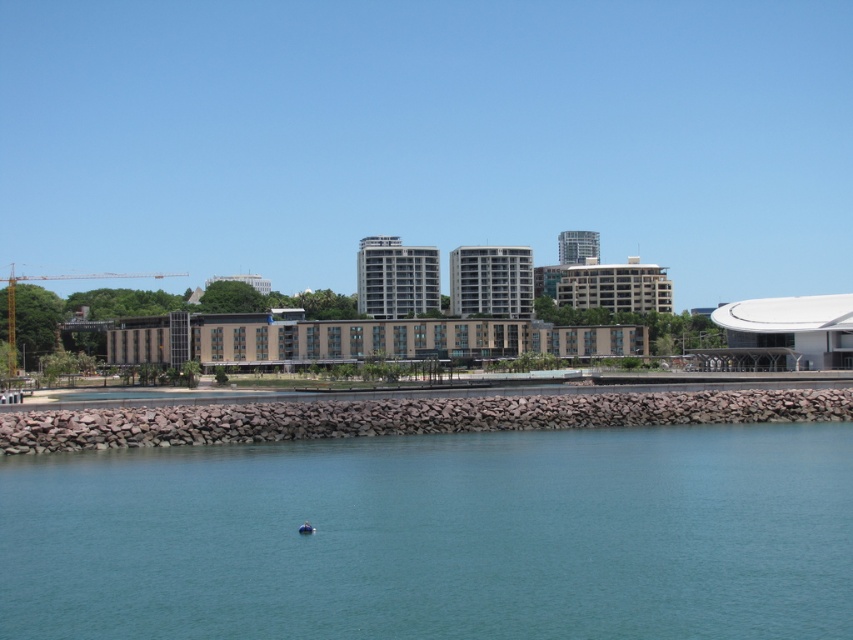
You are a photographer planning to take a photo of the waterfront scene. You want to ensure that both the clear blue water at center and the blue rubber boat at lower center are visible in the frame. Based on their sizes, which object should you prioritize positioning closer to the center of your composition to maintain balance?

The clear blue water at center is larger in size than the blue rubber boat at lower center. To maintain balance in the composition, prioritize positioning the smaller blue rubber boat at lower center closer to the center of the frame, as larger objects naturally draw more attention and can be placed slightly off center.

You are standing on the breakwater and see the clear blue water at center and the blue rubber boat at lower center. Which object is positioned to the right of the other?

The clear blue water at center is to the right of the blue rubber boat at lower center.